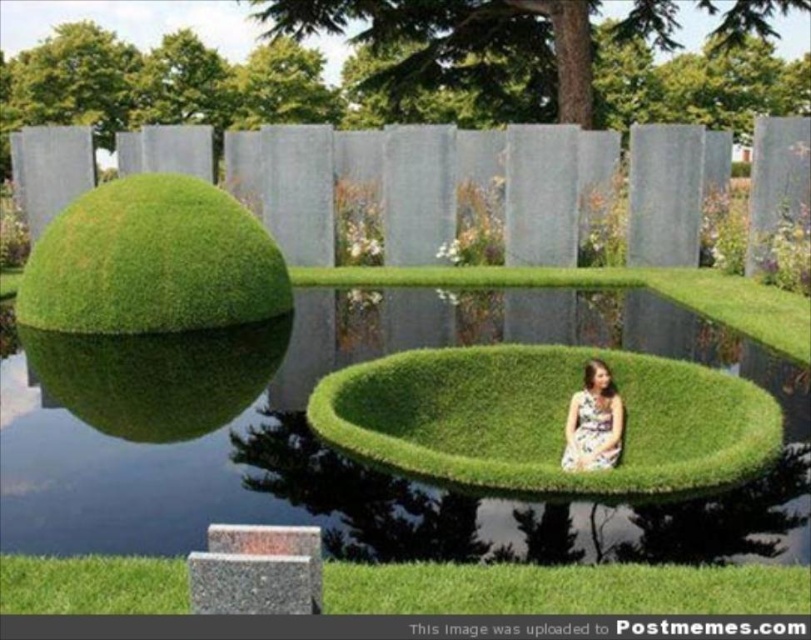
You are standing in the surreal garden described. You see the green grassy sphere at left and the floral dress at center. Which object is positioned further to the left?

The green grassy sphere at left is positioned further to the left than the floral dress at center.

You are planning to take a photo of the green grassy sphere at left and the floral dress at center. To ensure both are in frame, do you think the camera needs to zoom in or out?

The green grassy sphere at left might be wider than floral dress at center, so to include both in the frame, you should zoom out slightly to accommodate the wider object.

You are a photographer planning to take a photo of the floral dress at center and the green grassy bowl at center. To ensure both are in focus, you need to know their vertical positions. Which object is higher in the image?

The green grassy bowl at center is positioned over the floral dress at center, so it is higher in the image.